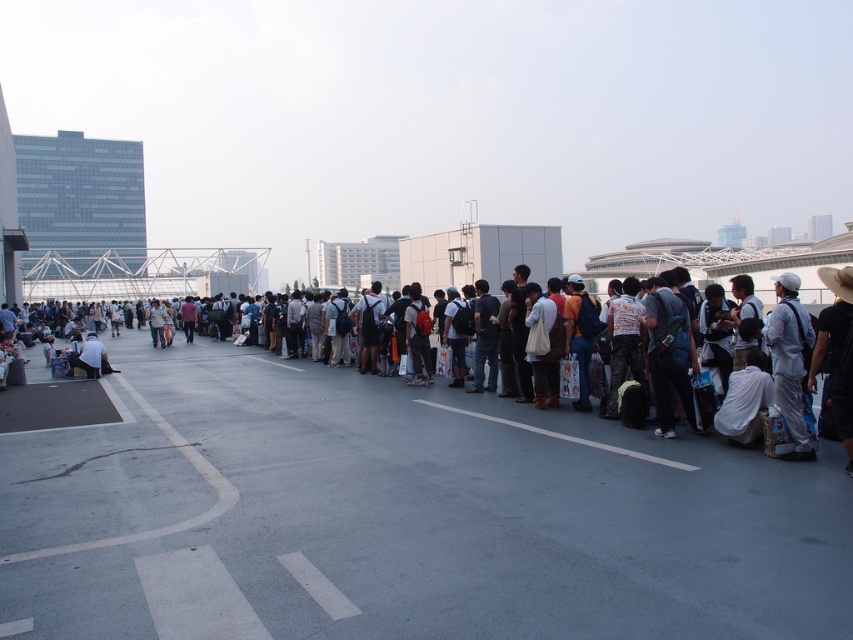
You are in a large outdoor gathering and need to locate two items. You see a dark gray backpack at center and a light brown leather jacket at lower left. Which item is positioned to the right of the other?

The dark gray backpack at center is positioned on the right side of light brown leather jacket at lower left.

You are a photographer trying to capture a clear shot of the dark gray backpack at center and the light brown leather jacket at lower left. Since you want both items to be visible in your photo, which object should you focus on first to ensure it appears larger in the frame?

The dark gray backpack at center should be focused on first because it has a greater height compared to the light brown leather jacket at lower left, making it naturally larger in the frame.

You are standing at the front of the queue and notice a camera and a dark gray backpack at center. Which item is closer to you?

The dark gray backpack at center is closer to you because it is only 12.70 feet away from the camera, which is farther away.